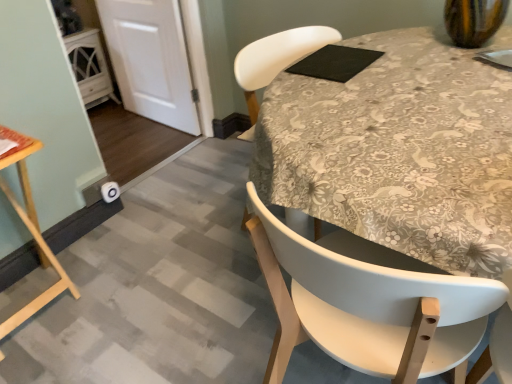
This screenshot has height=384, width=512. Describe the element at coordinates (368, 303) in the screenshot. I see `white matte chair at center` at that location.

Where is `floral fabric tablecloth at center`? The height and width of the screenshot is (384, 512). floral fabric tablecloth at center is located at coordinates (398, 151).

What do you see at coordinates (151, 60) in the screenshot?
I see `white matte door at lower left` at bounding box center [151, 60].

At what (x,y) coordinates should I click in order to perform the action: click on wooden table at lower left. Please return your answer as a coordinate pair (x, y). The height and width of the screenshot is (384, 512). Looking at the image, I should click on (30, 228).

Is black matte pad at upper center to the left of white matte chair at center from the viewer's perspective?

Correct, you'll find black matte pad at upper center to the left of white matte chair at center.

Would you say black matte pad at upper center contains white matte chair at center?

No.

Is there a large distance between black matte pad at upper center and white matte chair at center?

No, black matte pad at upper center is not far from white matte chair at center.

Consider the image. Considering the sizes of objects black matte pad at upper center and white matte chair at center in the image provided, who is taller, black matte pad at upper center or white matte chair at center?

white matte chair at center is taller.

Is floral fabric tablecloth at center aimed at black matte pad at upper center?

No, floral fabric tablecloth at center is not facing towards black matte pad at upper center.

Considering the sizes of floral fabric tablecloth at center and black matte pad at upper center in the image, is floral fabric tablecloth at center bigger or smaller than black matte pad at upper center?

In the image, floral fabric tablecloth at center appears to be larger than black matte pad at upper center.

Is black matte pad at upper center inside floral fabric tablecloth at center?

Indeed, black matte pad at upper center is located within floral fabric tablecloth at center.

Between floral fabric tablecloth at center and black matte pad at upper center, which one appears on the left side from the viewer's perspective?

floral fabric tablecloth at center is more to the left.

Is white matte door at lower left completely or partially inside white matte chair at center?

That's incorrect, white matte door at lower left is not inside white matte chair at center.

Which is more to the left, white matte chair at center or white matte door at lower left?

white matte door at lower left.

Is white matte chair at center turned away from white matte door at lower left?

white matte chair at center is not turned away from white matte door at lower left.

Is floral fabric tablecloth at center aimed at wooden table at lower left?

No, floral fabric tablecloth at center is not aimed at wooden table at lower left.

How distant is floral fabric tablecloth at center from wooden table at lower left?

They are 3.39 feet apart.

Is floral fabric tablecloth at center further to the viewer compared to wooden table at lower left?

Yes, floral fabric tablecloth at center is further from the viewer.

Which is closer to the camera, (323, 52) or (266, 201)?

Clearly, point (323, 52) is more distant from the camera than point (266, 201).

Considering their positions, is black matte pad at upper center located in front of or behind floral fabric tablecloth at center?

Visually, black matte pad at upper center is located behind floral fabric tablecloth at center.

Considering the relative positions of black matte pad at upper center and floral fabric tablecloth at center in the image provided, is black matte pad at upper center to the left of floral fabric tablecloth at center from the viewer's perspective?

In fact, black matte pad at upper center is to the right of floral fabric tablecloth at center.

From a real-world perspective, between black matte pad at upper center and floral fabric tablecloth at center, who is vertically higher?

black matte pad at upper center is physically above.

From the picture: Measure the distance from floral fabric tablecloth at center to white matte chair at center.

The distance of floral fabric tablecloth at center from white matte chair at center is 27.19 centimeters.

From the image's perspective, which is below, floral fabric tablecloth at center or white matte chair at center?

white matte chair at center appears lower in the image.

Is floral fabric tablecloth at center not near white matte chair at center?

floral fabric tablecloth at center is near white matte chair at center, not far away.

In the scene shown: Which of these two, floral fabric tablecloth at center or white matte chair at center, stands taller?

white matte chair at center is taller.

Is white matte door at lower left surrounding black matte pad at upper center?

No, black matte pad at upper center is not inside white matte door at lower left.

Can you confirm if white matte door at lower left is wider than black matte pad at upper center?

No, white matte door at lower left is not wider than black matte pad at upper center.

Which object is further away from the camera, white matte door at lower left or black matte pad at upper center?

Positioned behind is white matte door at lower left.

This screenshot has height=384, width=512. I want to click on chair on the right of the black matte pad at upper center, so click(368, 303).

This screenshot has height=384, width=512. What are the coordinates of `round table that appears in front of the black matte pad at upper center` in the screenshot? It's located at (398, 151).

From the image, which object appears to be farther from black matte pad at upper center, wooden table at lower left or floral fabric tablecloth at center?

wooden table at lower left lies further to black matte pad at upper center than the other object.

Which object lies further to the anchor point floral fabric tablecloth at center, black matte pad at upper center or white matte chair at center?

white matte chair at center is further to floral fabric tablecloth at center.

Based on their spatial positions, is wooden table at lower left or black matte pad at upper center closer to white matte chair at center?

The object closer to white matte chair at center is black matte pad at upper center.

Considering their positions, is white matte chair at center positioned further to white matte door at lower left than floral fabric tablecloth at center?

white matte chair at center is further to white matte door at lower left.

Considering their positions, is white matte door at lower left positioned further to black matte pad at upper center than wooden table at lower left?

white matte door at lower left is further to black matte pad at upper center.

Considering their positions, is wooden table at lower left positioned closer to floral fabric tablecloth at center than white matte door at lower left?

wooden table at lower left.

Consider the image. Looking at the image, which one is located closer to white matte chair at center, wooden table at lower left or white matte door at lower left?

wooden table at lower left is positioned closer to the anchor white matte chair at center.

Based on their spatial positions, is white matte chair at center or white matte door at lower left closer to wooden table at lower left?

white matte chair at center is positioned closer to the anchor wooden table at lower left.

You are a GUI agent. You are given a task and a screenshot of the screen. Output one action in this format:
    pyautogui.click(x=<x>, y=<y>)
    Task: Click on the round table between white matte chair at center and white matte door at lower left along the z-axis
    The height and width of the screenshot is (384, 512).
    Given the screenshot: What is the action you would take?
    pyautogui.click(x=398, y=151)

Identify the location of pad positioned between white matte chair at center and white matte door at lower left from near to far. The height and width of the screenshot is (384, 512). (335, 63).

Locate an element on the screen. The image size is (512, 384). round table between white matte chair at center and black matte pad at upper center along the z-axis is located at coordinates (398, 151).

Identify the location of round table between wooden table at lower left and white matte chair at center from left to right. (398, 151).